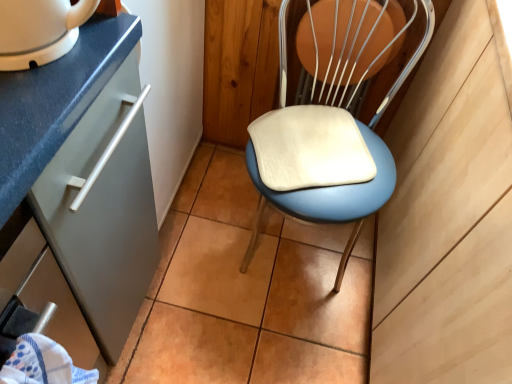
Measure the distance between blue padded chair at center and camera.

A distance of 1.03 meters exists between blue padded chair at center and camera.

This screenshot has height=384, width=512. What are the coordinates of `blue padded chair at center` in the screenshot? It's located at (324, 154).

You are a GUI agent. You are given a task and a screenshot of the screen. Output one action in this format:
    pyautogui.click(x=<x>, y=<y>)
    Task: Click on the blue fabric towel at lower left
    
    Given the screenshot: What is the action you would take?
    pyautogui.click(x=42, y=364)

Can you confirm if white glossy mug at upper left is smaller than blue fabric towel at lower left?

Yes.

Does white glossy mug at upper left have a lesser width compared to blue fabric towel at lower left?

Incorrect, the width of white glossy mug at upper left is not less than that of blue fabric towel at lower left.

Is blue fabric towel at lower left inside white glossy mug at upper left?

Definitely not — blue fabric towel at lower left is not inside white glossy mug at upper left.

Locate an element on the screen. The image size is (512, 384). home appliance above the blue fabric towel at lower left (from the image's perspective) is located at coordinates pyautogui.click(x=39, y=30).

Considering the sizes of objects blue fabric towel at lower left and blue padded chair at center in the image provided, who is shorter, blue fabric towel at lower left or blue padded chair at center?

With less height is blue fabric towel at lower left.

Is the depth of blue fabric towel at lower left greater than that of blue padded chair at center?

No, blue fabric towel at lower left is in front of blue padded chair at center.

Are blue fabric towel at lower left and blue padded chair at center making contact?

No.

Considering the relative sizes of blue fabric towel at lower left and blue padded chair at center in the image provided, is blue fabric towel at lower left bigger than blue padded chair at center?

Actually, blue fabric towel at lower left might be smaller than blue padded chair at center.

From the image's perspective, is blue fabric towel at lower left above or below white glossy mug at upper left?

blue fabric towel at lower left is below white glossy mug at upper left.

Does blue fabric towel at lower left come behind white glossy mug at upper left?

No, blue fabric towel at lower left is closer to the viewer.

From a real-world perspective, which object stands above the other?

white glossy mug at upper left, from a real-world perspective.

Is white glossy mug at upper left to the left of blue padded chair at center from the viewer's perspective?

Yes.

Is blue padded chair at center surrounded by white glossy mug at upper left?

No, blue padded chair at center is not a part of white glossy mug at upper left.

Which object is more forward, white glossy mug at upper left or blue padded chair at center?

white glossy mug at upper left is in front.

Does white glossy mug at upper left have a lesser height compared to blue padded chair at center?

Indeed, white glossy mug at upper left has a lesser height compared to blue padded chair at center.

From a real-world perspective, is blue padded chair at center physically below blue fabric towel at lower left?

Indeed, from a real-world perspective, blue padded chair at center is positioned beneath blue fabric towel at lower left.

From the image's perspective, relative to blue fabric towel at lower left, is blue padded chair at center above or below?

blue padded chair at center is situated higher than blue fabric towel at lower left in the image.

Between blue padded chair at center and blue fabric towel at lower left, which one is positioned behind?

blue padded chair at center.

Is blue padded chair at center turned away from blue fabric towel at lower left?

blue padded chair at center is not turned away from blue fabric towel at lower left.

From the image's perspective, relative to white glossy mug at upper left, is blue padded chair at center above or below?

From the image's perspective, blue padded chair at center appears below white glossy mug at upper left.

Considering the relative positions of blue padded chair at center and white glossy mug at upper left in the image provided, is blue padded chair at center to the left or to the right of white glossy mug at upper left?

In the image, blue padded chair at center appears on the right side of white glossy mug at upper left.

From a real-world perspective, between blue padded chair at center and white glossy mug at upper left, who is vertically higher?

white glossy mug at upper left is physically above.

In order to click on material on the right of white glossy mug at upper left in this screenshot , I will do `click(42, 364)`.

Identify the location of chair behind the blue fabric towel at lower left. This screenshot has width=512, height=384. (324, 154).

Estimate the real-world distances between objects in this image. Which object is closer to white glossy mug at upper left, blue fabric towel at lower left or blue padded chair at center?

blue fabric towel at lower left is closer to white glossy mug at upper left.

Considering their positions, is blue fabric towel at lower left positioned closer to blue padded chair at center than white glossy mug at upper left?

white glossy mug at upper left lies closer to blue padded chair at center than the other object.

From the image, which object appears to be nearer to blue fabric towel at lower left, white glossy mug at upper left or blue padded chair at center?

The object closer to blue fabric towel at lower left is white glossy mug at upper left.

Which object lies further to the anchor point blue fabric towel at lower left, blue padded chair at center or white glossy mug at upper left?

blue padded chair at center is further to blue fabric towel at lower left.

From the image, which object appears to be nearer to blue padded chair at center, white glossy mug at upper left or blue fabric towel at lower left?

white glossy mug at upper left.

From the image, which object appears to be farther from white glossy mug at upper left, blue padded chair at center or blue fabric towel at lower left?

Based on the image, blue padded chair at center appears to be further to white glossy mug at upper left.

The width and height of the screenshot is (512, 384). I want to click on chair between white glossy mug at upper left and blue fabric towel at lower left in the up-down direction, so click(324, 154).